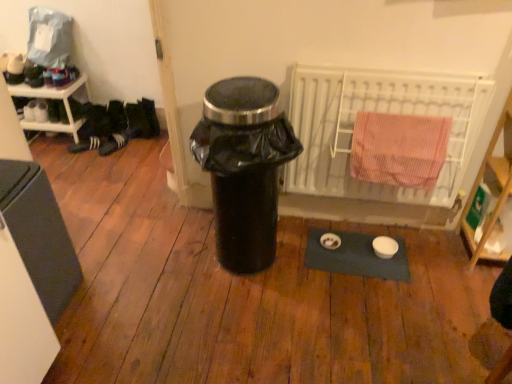
What are the coordinates of `free spot in front of black plastic trash can at center` in the screenshot? It's located at (239, 316).